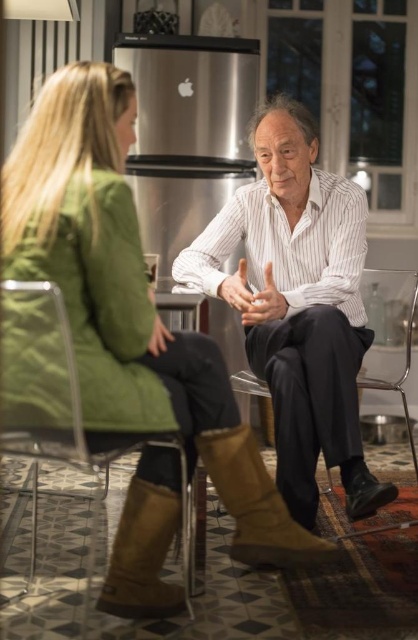
You are a delivery person who needs to place a small package on the clear plastic chair at lower left without covering the matte white hand at center. Is there enough space?

The clear plastic chair at lower left is bigger than the matte white hand at center, so there should be enough space to place the small package on the clear plastic chair at lower left without covering the matte white hand at center.

You are standing in the kitchen and want to hand a document to the person wearing the white striped shirt at center. The transparent plastic chair at center is blocking your path. Can you walk around the chair to reach them?

The white striped shirt at center is closer to the viewer than the transparent plastic chair at center, so you can walk around the transparent plastic chair at center to reach the person since the chair is behind them.

You are trying to locate the clear plastic chair at lower left in the kitchen. According to the scene description, where would you find it in relation to the matte white hand at center?

The clear plastic chair at lower left is located to the left of the matte white hand at center.